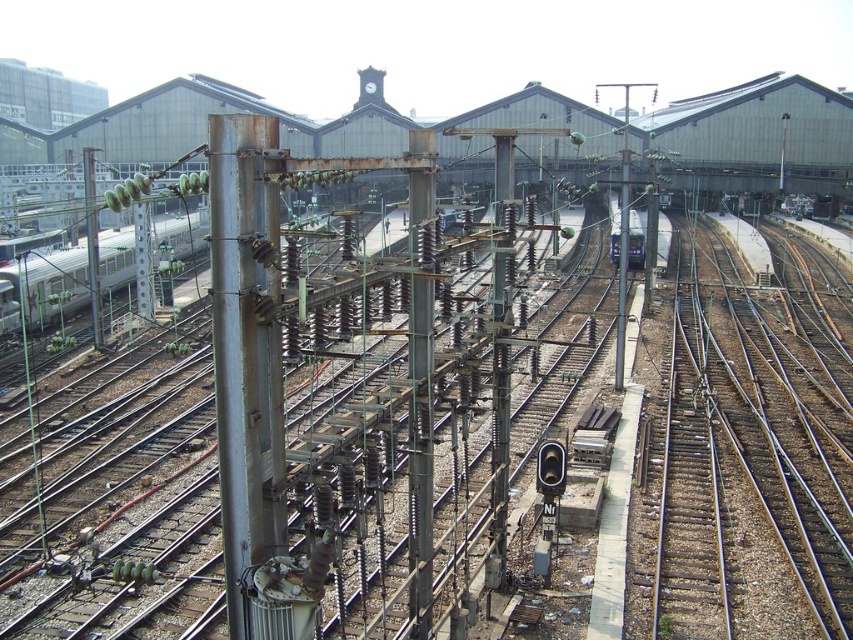
Question: Which point is closer to the camera?

Choices:
 (A) metallic blue train at center
 (B) rusty metal pole at center
 (C) metallic pole at left
 (D) silver metallic train at left

Answer: (B)

Question: Does rusty metal pole at center have a greater width compared to silver metallic train at left?

Choices:
 (A) no
 (B) yes

Answer: (A)

Question: Considering the relative positions of silver metallic train at left and metallic pole at left in the image provided, where is silver metallic train at left located with respect to metallic pole at left?

Choices:
 (A) left
 (B) right

Answer: (A)

Question: Which point is farther to the camera?

Choices:
 (A) (415, 605)
 (B) (183, 220)
 (C) (819, 552)
 (D) (224, 278)

Answer: (B)

Question: Is rusty metal pole at center in front of metallic pole at left?

Choices:
 (A) yes
 (B) no

Answer: (A)

Question: Among these objects, which one is farthest from the camera?

Choices:
 (A) silver metallic train at left
 (B) rusty metal pole at center
 (C) brown gravel train track at right

Answer: (A)